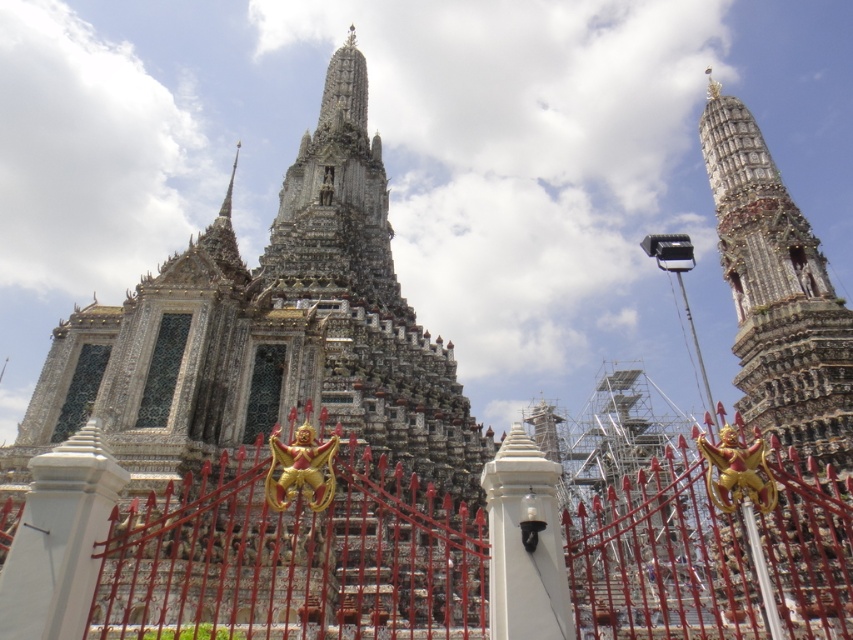
Who is higher up, carved stone spire at upper right or white stone pillar at center?

carved stone spire at upper right is above.

Does point (798, 273) lie behind point (26, 589)?

Yes, point (798, 273) is behind point (26, 589).

Locate an element on the screen. This screenshot has height=640, width=853. carved stone spire at upper right is located at coordinates (776, 291).

Identify the location of carved stone spire at upper right. The height and width of the screenshot is (640, 853). (776, 291).

Who is more distant from viewer, (360, 586) or (96, 435)?

Positioned behind is point (360, 586).

Which is in front, point (212, 476) or point (4, 566)?

Positioned in front is point (4, 566).

Locate an element on the screen. This screenshot has height=640, width=853. red metal gate at center is located at coordinates (289, 561).

Does red metal gate at center have a larger size compared to white glossy pillar at center?

Indeed, red metal gate at center has a larger size compared to white glossy pillar at center.

Can you confirm if red metal gate at center is positioned below white glossy pillar at center?

Yes.

The width and height of the screenshot is (853, 640). Describe the element at coordinates (289, 561) in the screenshot. I see `red metal gate at center` at that location.

At what (x,y) coordinates should I click in order to perform the action: click on red metal gate at center. Please return your answer as a coordinate pair (x, y). This screenshot has height=640, width=853. Looking at the image, I should click on (289, 561).